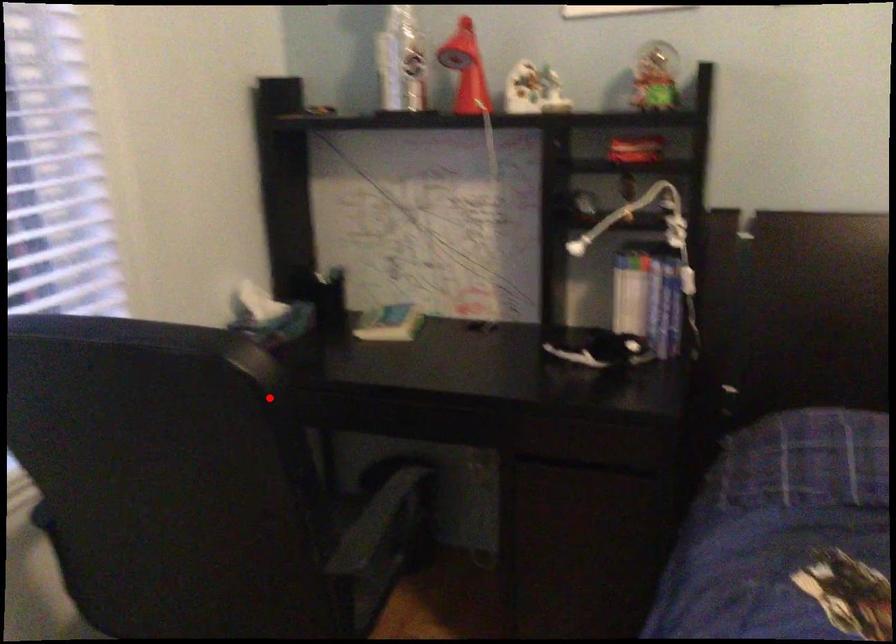
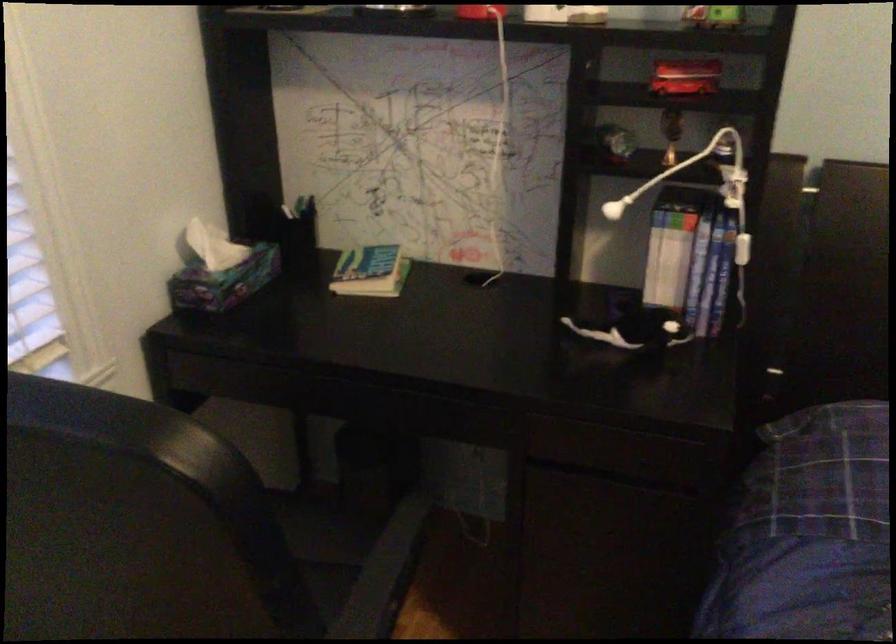
Question: I am providing you with two images of the same scene from different viewpoints. In image1, a red point is highlighted. Considering the same 3D point in image2, which of the following is correct?

Choices:
 (A) It is closer
 (B) It is farther

Answer: (A)